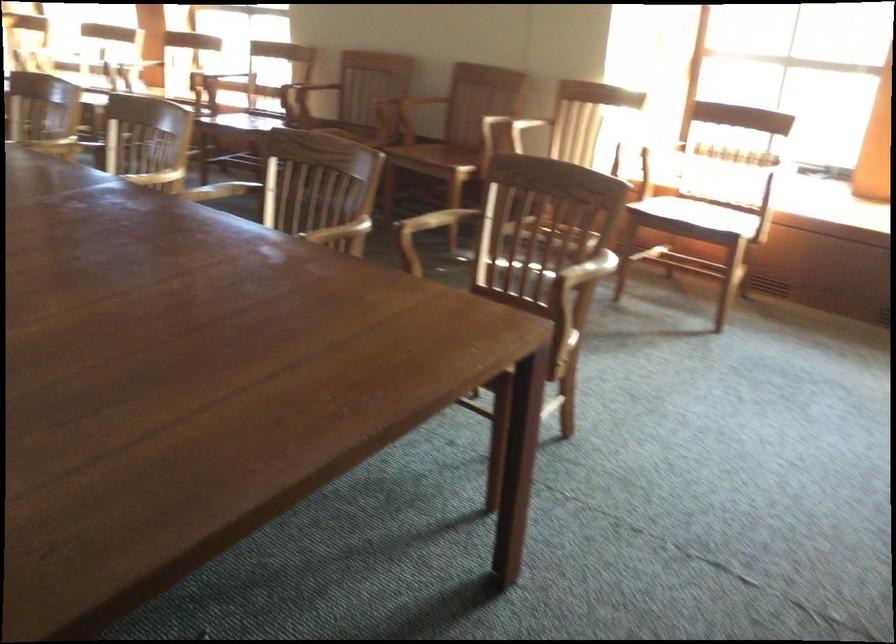
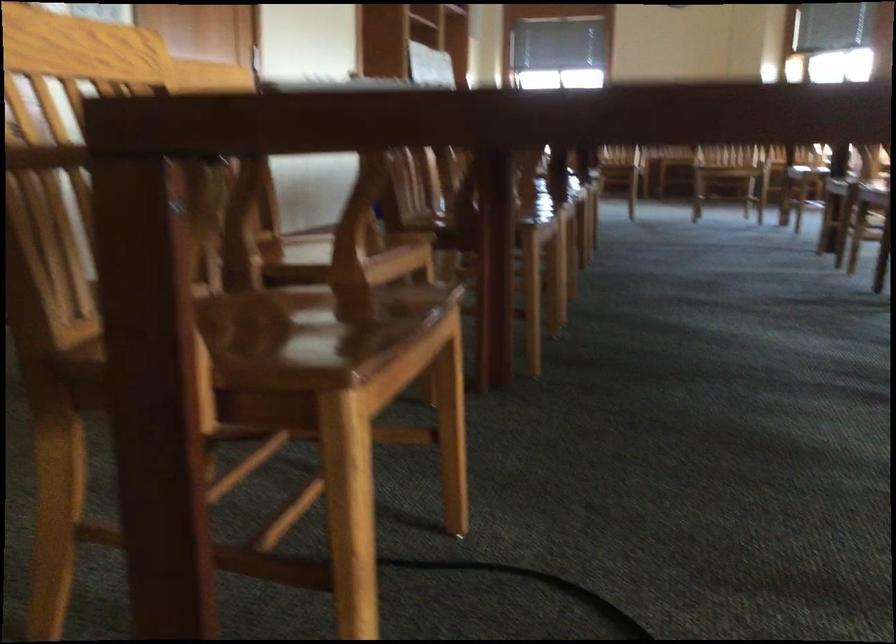
Question: Based on the continuous images, in which direction is the camera rotating? Reply with the corresponding letter.

Choices:
 (A) Left
 (B) Right
 (C) Up
 (D) Down

Answer: (A)